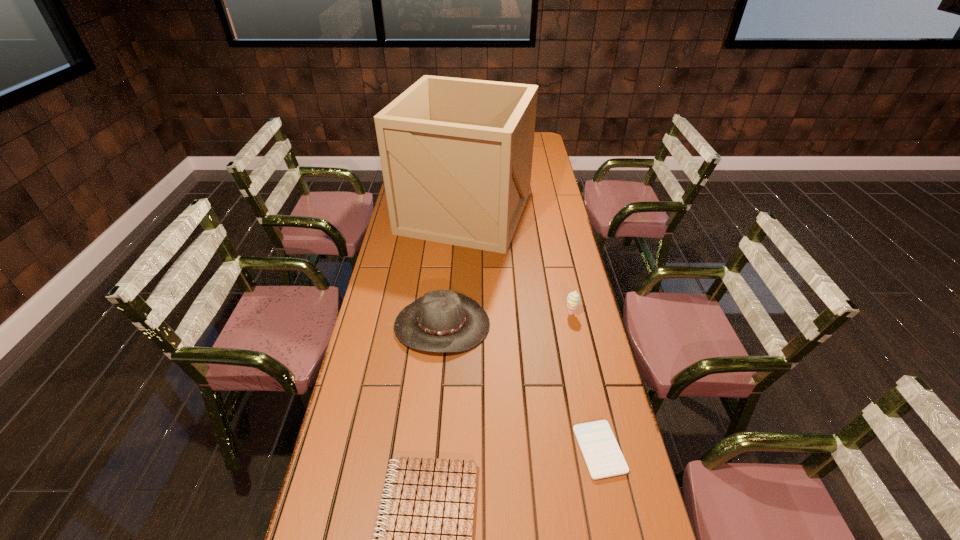
Identify the location of hat present at the left edge. (441, 321).

The height and width of the screenshot is (540, 960). What are the coordinates of `box positioned at the right edge` in the screenshot? It's located at (456, 154).

At what (x,y) coordinates should I click in order to perform the action: click on sherbert at the right edge. Please return your answer as a coordinate pair (x, y). This screenshot has width=960, height=540. Looking at the image, I should click on (573, 298).

Where is `calculator that is at the right edge`? The height and width of the screenshot is (540, 960). calculator that is at the right edge is located at coordinates (601, 452).

The image size is (960, 540). In the image, there is a desktop. What are the coordinates of `blank space at the left edge` in the screenshot? It's located at (396, 235).

The image size is (960, 540). In order to click on vacant space at the right edge of the desktop in this screenshot , I will do `click(532, 198)`.

Identify the location of blank region between the hat and the shortest object. (521, 387).

The width and height of the screenshot is (960, 540). In order to click on free space between the sherbert and the hat in this screenshot , I will do `click(506, 319)`.

The height and width of the screenshot is (540, 960). I want to click on vacant space that's between the hat and the shortest object, so click(521, 387).

Where is `vacant space in between the sherbert and the box`? The image size is (960, 540). vacant space in between the sherbert and the box is located at coordinates (517, 263).